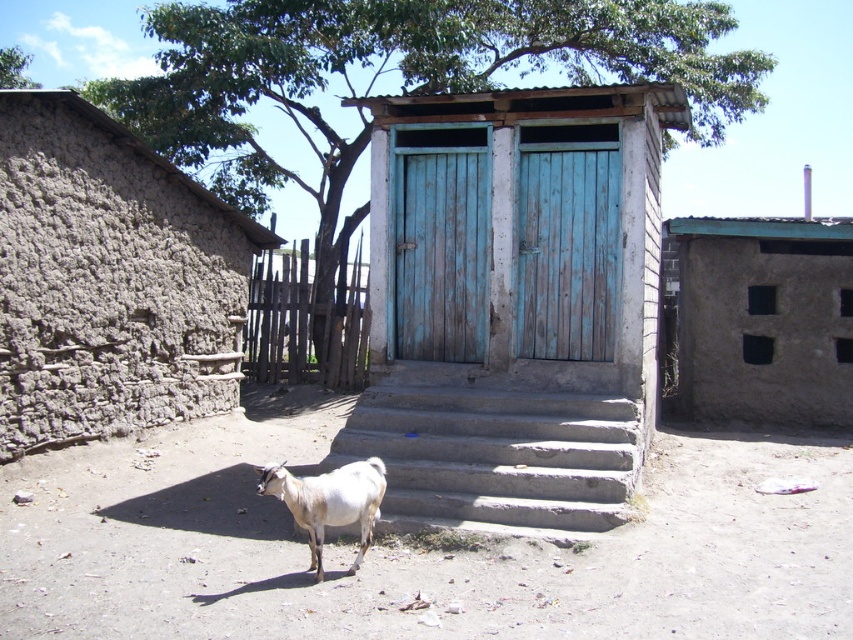
What do you see at coordinates (567, 248) in the screenshot?
I see `weathered teal wood door at center` at bounding box center [567, 248].

This screenshot has width=853, height=640. What do you see at coordinates (567, 248) in the screenshot?
I see `weathered teal wood door at center` at bounding box center [567, 248].

Identify the location of weathered teal wood door at center. The height and width of the screenshot is (640, 853). (567, 248).

Is concrete stairs at center further to the viewer compared to green leafy tree at upper left?

No, it is in front of green leafy tree at upper left.

Does point (486, 504) come behind point (6, 68)?

No, it is not.

Does point (413, 500) come farther from viewer compared to point (18, 83)?

No, it is in front of (18, 83).

Identify the location of concrete stairs at center. (498, 445).

Does green leafy tree at upper center have a lesser width compared to white woolen goat at lower center?

No, green leafy tree at upper center is not thinner than white woolen goat at lower center.

Between green leafy tree at upper center and white woolen goat at lower center, which one has less height?

Standing shorter between the two is white woolen goat at lower center.

This screenshot has width=853, height=640. What do you see at coordinates (399, 76) in the screenshot?
I see `green leafy tree at upper center` at bounding box center [399, 76].

At what (x,y) coordinates should I click in order to perform the action: click on green leafy tree at upper center. Please return your answer as a coordinate pair (x, y). Looking at the image, I should click on (399, 76).